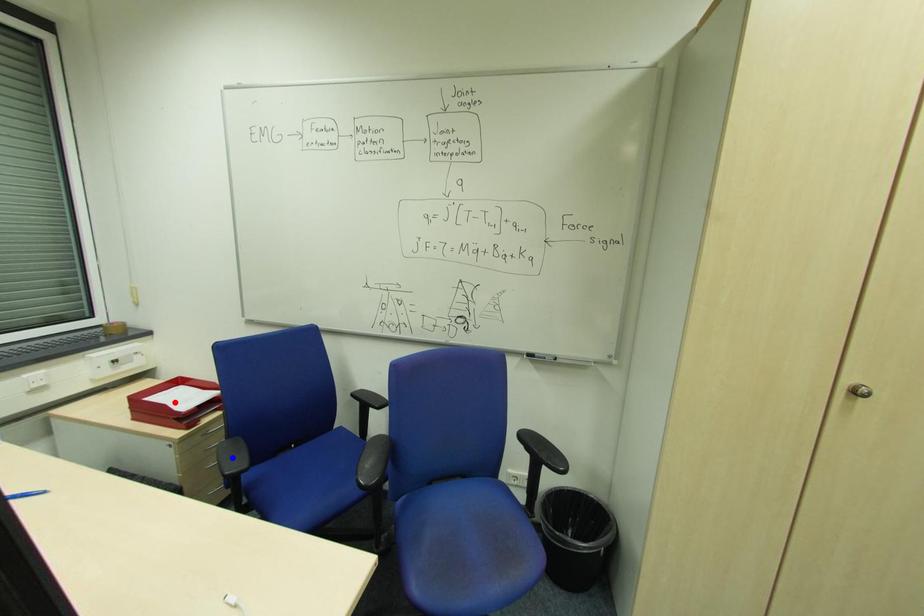
Question: In the image, two points are highlighted. Which point is nearer to the camera? Reply with the corresponding letter.

Choices:
 (A) blue point
 (B) red point

Answer: (A)